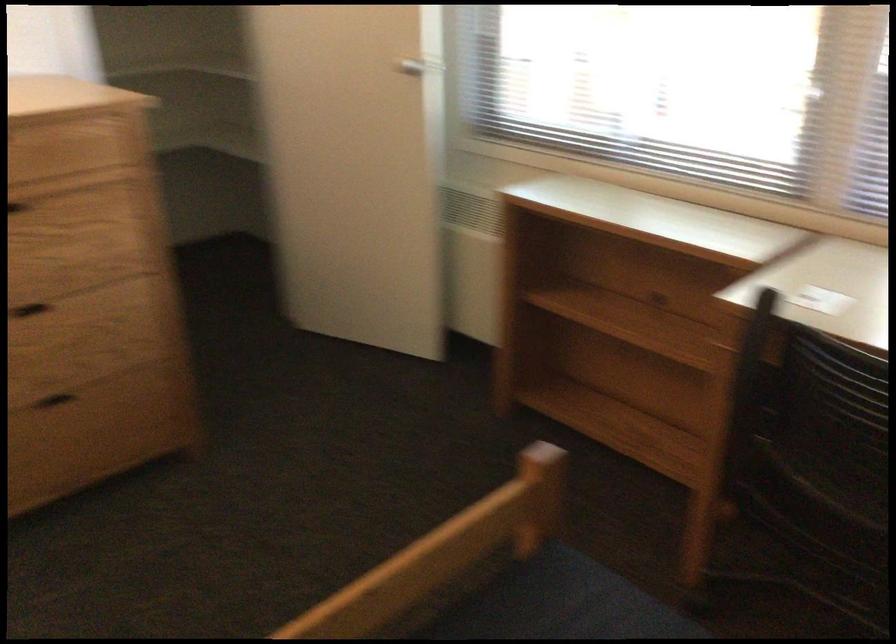
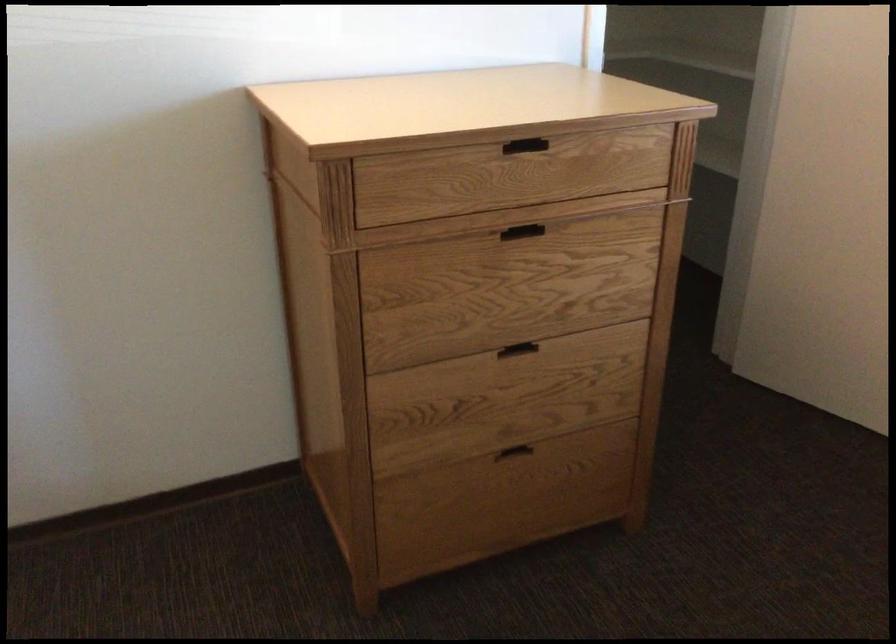
Question: The camera is either moving clockwise (left) or counter-clockwise (right) around the object. The first image is from the beginning of the video and the second image is from the end. Is the camera moving left or right when shooting the video?

Choices:
 (A) Left
 (B) Right

Answer: (B)